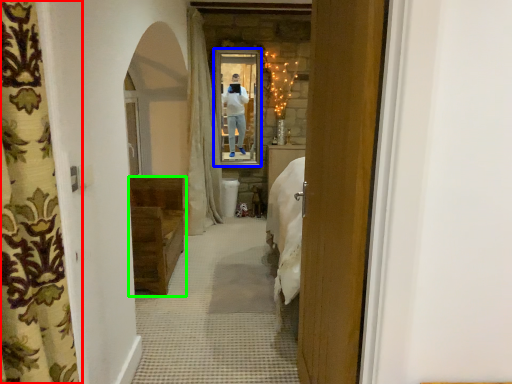
Question: Based on their relative distances, which object is farther from curtain (highlighted by a red box)? Choose from mirror (highlighted by a blue box) and furniture (highlighted by a green box).

Choices:
 (A) mirror
 (B) furniture

Answer: (A)